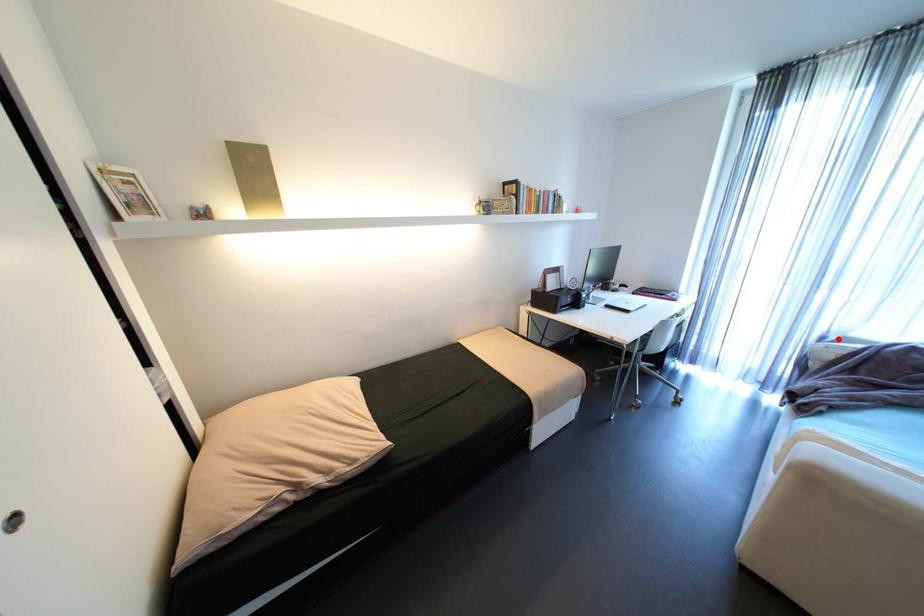
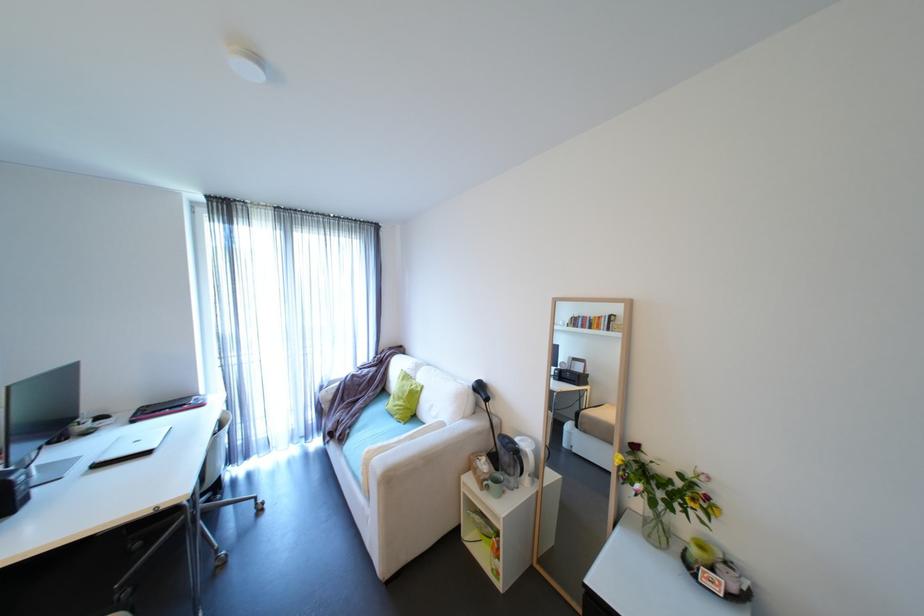
Locate, in the second image, the point that corresponds to the highlighted location in the first image.

(333, 386)